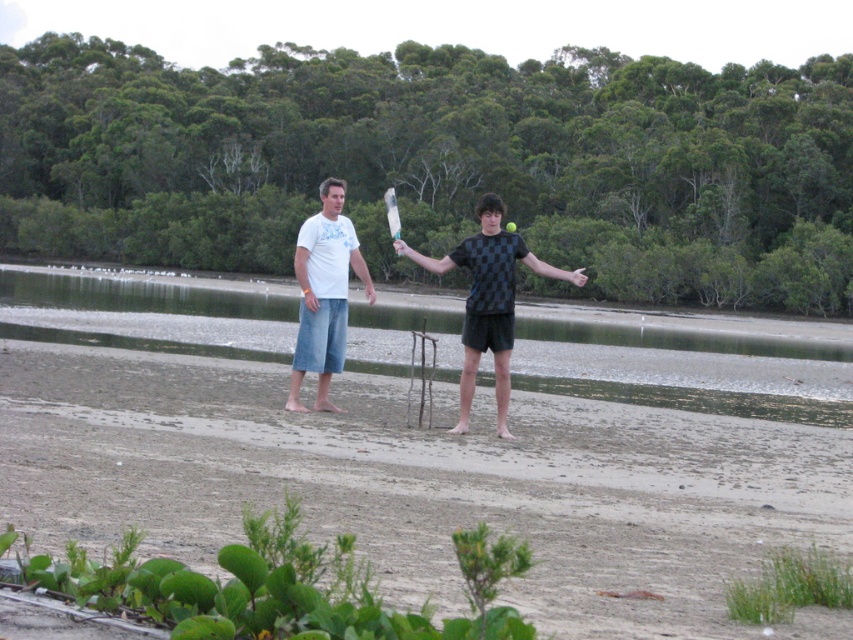
Is matte white t-shirt at center bigger than white cotton t-shirt at center?

Correct, matte white t-shirt at center is larger in size than white cotton t-shirt at center.

Can you confirm if matte white t-shirt at center is shorter than white cotton t-shirt at center?

In fact, matte white t-shirt at center may be taller than white cotton t-shirt at center.

Locate an element on the screen. matte white t-shirt at center is located at coordinates coord(488,300).

Find the location of a particular element. This screenshot has width=853, height=640. matte white t-shirt at center is located at coordinates click(x=488, y=300).

Which is in front, point (402, 477) or point (506, 330)?

Point (402, 477) is more forward.

From the picture: Can you confirm if brown sandy beach at center is smaller than matte white t-shirt at center?

Actually, brown sandy beach at center might be larger than matte white t-shirt at center.

Between point (299, 429) and point (511, 276), which one is positioned behind?

The point (511, 276) is behind.

Where is `brown sandy beach at center`? The height and width of the screenshot is (640, 853). brown sandy beach at center is located at coordinates (419, 483).

Does brown sandy beach at center have a greater height compared to clear water at center?

No, brown sandy beach at center is not taller than clear water at center.

Between point (405, 385) and point (636, 384), which one is positioned in front?

Positioned in front is point (405, 385).

Identify the location of brown sandy beach at center. The width and height of the screenshot is (853, 640). (419, 483).